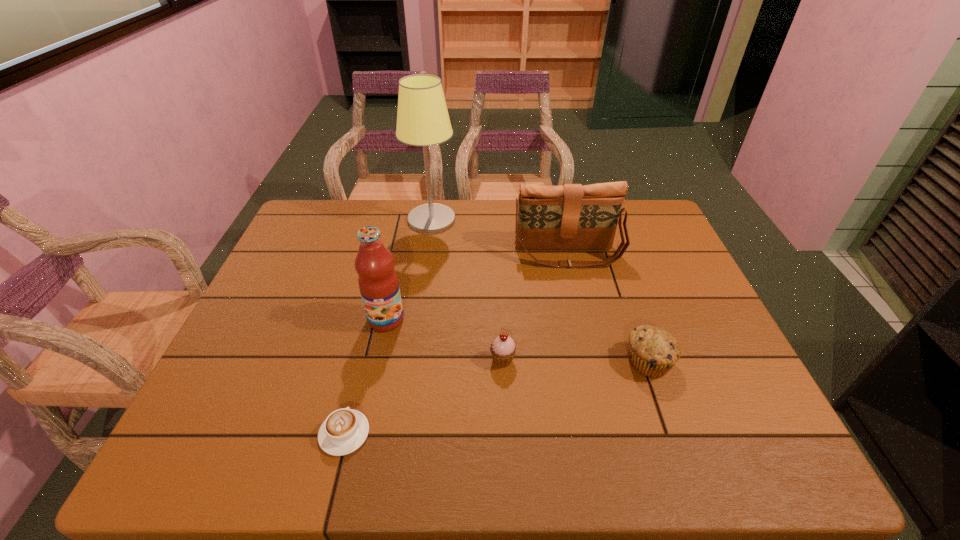
You are a GUI agent. You are given a task and a screenshot of the screen. Output one action in this format:
    pyautogui.click(x=<x>, y=<y>)
    Task: Click on the free spot that satisfies the following two spatial constraints: 1. with the handle on the right side of the cappuccino; 2. on the right side of the tallest object
    
    Given the screenshot: What is the action you would take?
    coord(396,220)

Identify the location of vacant region that satisfies the following two spatial constraints: 1. on the front label of the cupcake; 2. on the right side of the fourth nearest object. The height and width of the screenshot is (540, 960). (377, 360).

Where is `free space that satisfies the following two spatial constraints: 1. on the front label of the muffin; 2. on the left side of the third farthest object`? free space that satisfies the following two spatial constraints: 1. on the front label of the muffin; 2. on the left side of the third farthest object is located at coordinates (377, 361).

Find the location of `free space that satisfies the following two spatial constraints: 1. on the front label of the third object from right to left; 2. on the left side of the fruit juice`. free space that satisfies the following two spatial constraints: 1. on the front label of the third object from right to left; 2. on the left side of the fruit juice is located at coordinates (377, 360).

Where is `blank area in the image that satisfies the following two spatial constraints: 1. on the front label of the fourth object from left to right; 2. on the right side of the third farthest object`? Image resolution: width=960 pixels, height=540 pixels. blank area in the image that satisfies the following two spatial constraints: 1. on the front label of the fourth object from left to right; 2. on the right side of the third farthest object is located at coordinates pyautogui.click(x=377, y=360).

The image size is (960, 540). In order to click on vacant space that satisfies the following two spatial constraints: 1. on the front side of the muffin; 2. on the left side of the farthest object in this screenshot , I will do `click(412, 361)`.

Where is `blank space that satisfies the following two spatial constraints: 1. with the handle on the right side of the cappuccino; 2. on the left side of the table lamp`? Image resolution: width=960 pixels, height=540 pixels. blank space that satisfies the following two spatial constraints: 1. with the handle on the right side of the cappuccino; 2. on the left side of the table lamp is located at coordinates (396, 220).